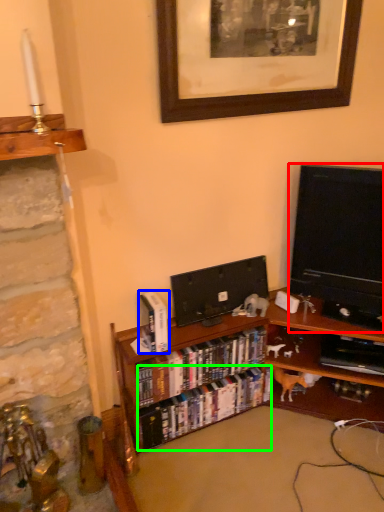
Question: Which object is positioned farthest from television (highlighted by a red box)? Select from book (highlighted by a blue box) and book (highlighted by a green box).

Choices:
 (A) book
 (B) book

Answer: (A)